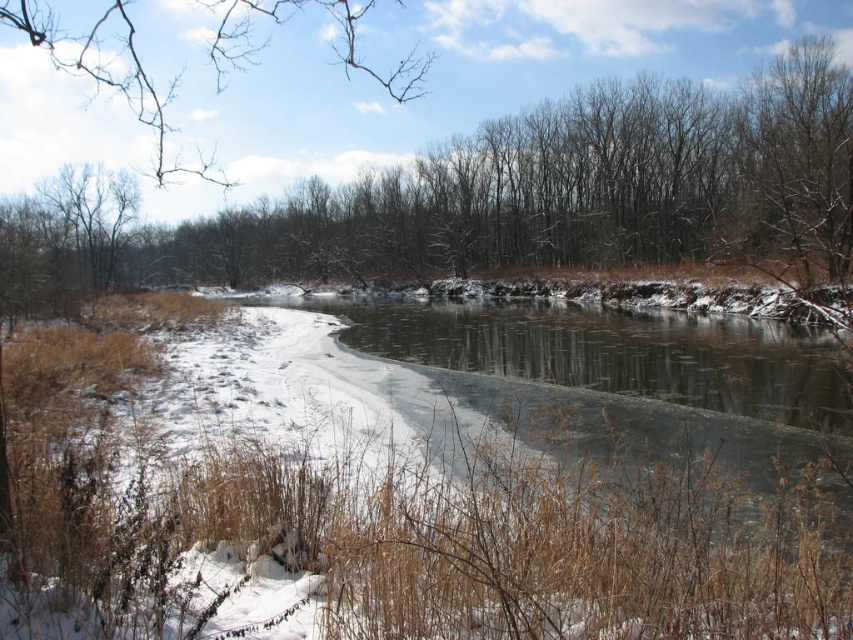
You are an environmental scientist assessing the winter landscape. You notice the brown leafless trees at center and the bare branches at upper left. Which of these two objects is smaller in size?

The brown leafless trees at center has a smaller size compared to the bare branches at upper left.

Looking at this image, you are standing at the point labeled point (757, 150) and want to walk to point (28, 3). Based on the scene description, which direction should you move to reach your destination?

You should move towards the lower left direction because point (757, 150) is closer to the camera than point (28, 3), meaning the destination is further away in that direction.

You are standing at the point marked as point (502, 196) in the image. What is the nearest object to you in the scene?

The nearest object to you at point (502, 196) is the brown leafless trees at center, as they are located exactly at that coordinate.